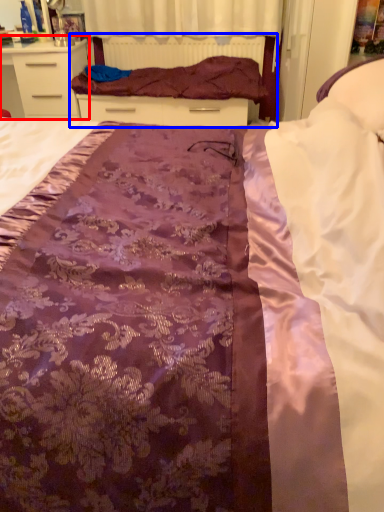
Question: Among these objects, which one is farthest to the camera, chest of drawers (highlighted by a red box) or bed frame (highlighted by a blue box)?

Choices:
 (A) chest of drawers
 (B) bed frame

Answer: (B)